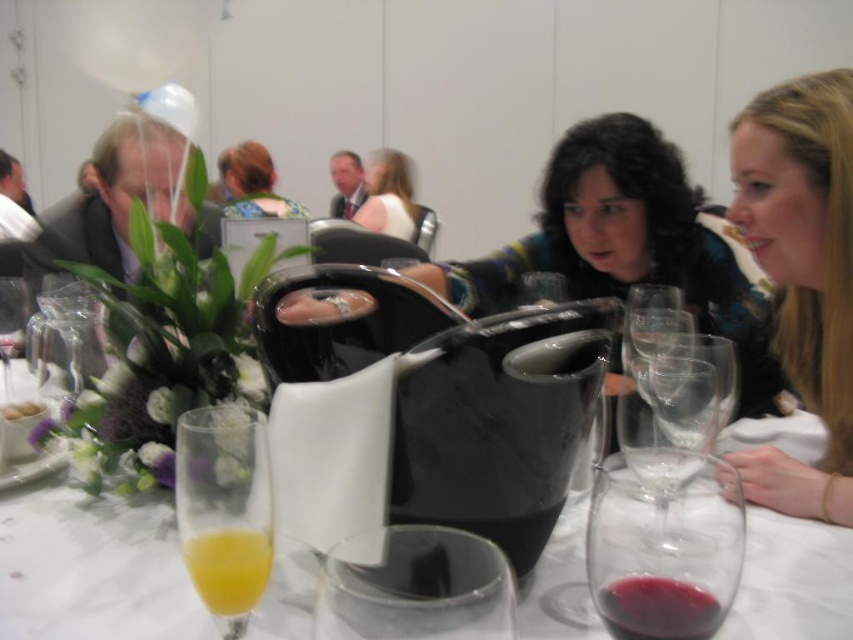
You are a server at a formal event and need to place a new drink order on the table. The order includes a glass of water and a coffee. You see the clear glass wine glass at center and the translucent glass of orange juice at lower left. Where should you place the new drinks to avoid spilling existing drinks?

Place the new drinks away from the clear glass wine glass at center and the translucent glass of orange juice at lower left to avoid spilling existing drinks. The clear glass wine glass at center is positioned on the right side of the translucent glass of orange juice at lower left, so placing the new drinks on the opposite side or in an empty area would be safer.

You are a server at a formal event and need to place a new wine glass exactly where the clear glass wine glass at center was. What are the coordinates where you should place the new wine glass?

The clear glass wine glass at center was located at coordinates point (672, 401), so you should place the new wine glass there.

You are a waiter at a formal event and need to serve drinks. You have a tray with both the clear glass wine glass at center and the translucent glass of orange juice at lower left. Which glass should you use if you need to pour a drink that requires a larger container?

The clear glass wine glass at center is bigger than the translucent glass of orange juice at lower left, so you should use the clear glass wine glass at center for the drink that requires a larger container.